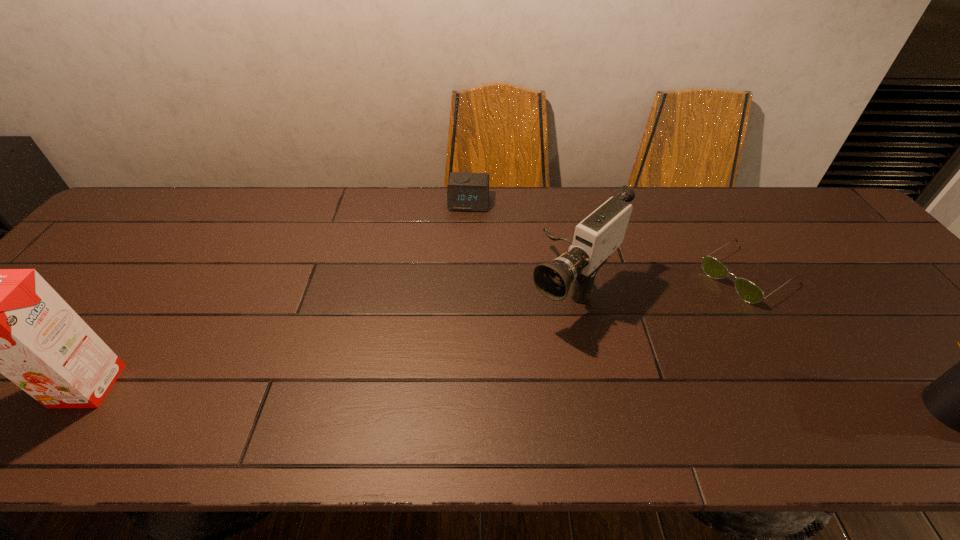
Where is `vacant space at the far edge of the desktop`? This screenshot has height=540, width=960. vacant space at the far edge of the desktop is located at coordinates (740, 223).

In the image, there is a desktop. Where is `free space at the near edge`? This screenshot has width=960, height=540. free space at the near edge is located at coordinates (857, 387).

In the image, there is a desktop. At what (x,y) coordinates should I click in order to perform the action: click on vacant region at the right edge. Please return your answer as a coordinate pair (x, y). The image size is (960, 540). Looking at the image, I should click on (908, 327).

Identify the location of free location at the far left corner. (113, 225).

Image resolution: width=960 pixels, height=540 pixels. In the image, there is a desktop. What are the coordinates of `vacant area at the far right corner` in the screenshot? It's located at (828, 204).

Find the location of a particular element. This screenshot has height=540, width=960. vacant region between the camcorder and the fourth object from left to right is located at coordinates (660, 282).

Locate an element on the screen. vacant area that lies between the shortest object and the third object from right to left is located at coordinates (660, 282).

Locate an element on the screen. The height and width of the screenshot is (540, 960). vacant area that lies between the fourth shortest object and the farthest object is located at coordinates (520, 246).

At what (x,y) coordinates should I click in order to perform the action: click on empty location between the alarm clock and the carton. Please return your answer as a coordinate pair (x, y). The image size is (960, 540). Looking at the image, I should click on (278, 294).

At what (x,y) coordinates should I click in order to perform the action: click on vacant region between the farthest object and the tallest object. Please return your answer as a coordinate pair (x, y). The height and width of the screenshot is (540, 960). Looking at the image, I should click on (278, 294).